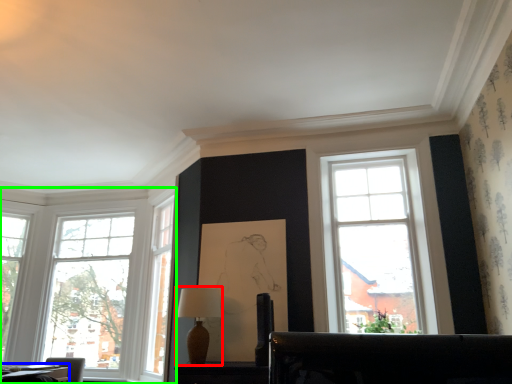
Question: Considering the real-world distances, which object is closest to table lamp (highlighted by a red box)? table (highlighted by a blue box) or window (highlighted by a green box).

Choices:
 (A) table
 (B) window

Answer: (A)